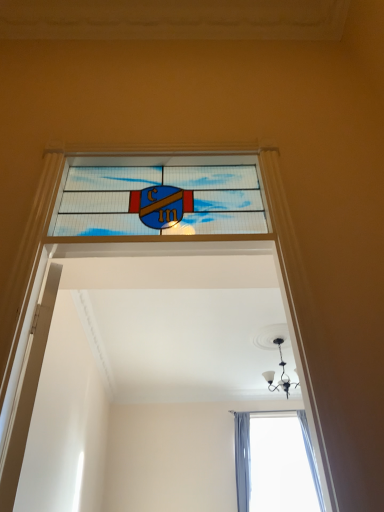
Question: From the image's perspective, relative to stained glass window at center, is black glass chandelier at upper center above or below?

Choices:
 (A) below
 (B) above

Answer: (A)

Question: From a real-world perspective, is black glass chandelier at upper center physically located above or below stained glass window at center?

Choices:
 (A) above
 (B) below

Answer: (A)

Question: Which is nearer to the stained glass window at center?

Choices:
 (A) white glossy door at left
 (B) black glass chandelier at upper center

Answer: (A)

Question: Considering the real-world distances, which object is closest to the black glass chandelier at upper center?

Choices:
 (A) white glossy door at left
 (B) stained glass window at center

Answer: (B)